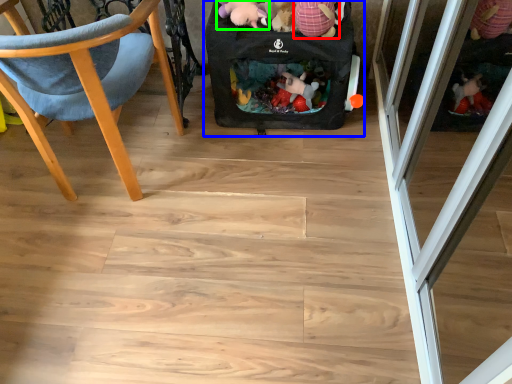
Question: Considering the real-world distances, which object is closest to toy (highlighted by a red box)? baby carriage (highlighted by a blue box) or toy (highlighted by a green box).

Choices:
 (A) baby carriage
 (B) toy

Answer: (B)